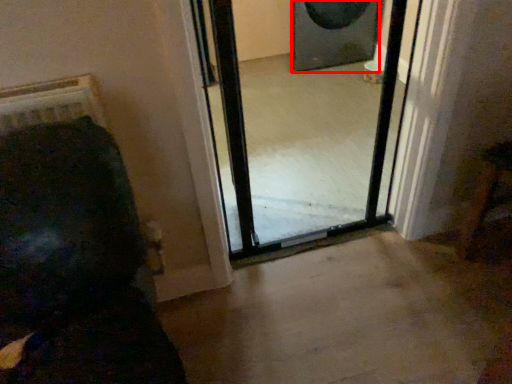
Question: From the image, what is the correct spatial relationship of speaker (annotated by the red box) in relation to screen door?

Choices:
 (A) right
 (B) left

Answer: (A)